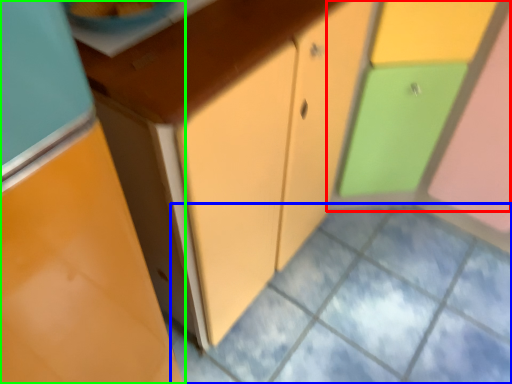
Question: Based on their relative distances, which object is nearer to cabinetry (highlighted by a red box)? Choose from square (highlighted by a blue box) and cabinetry (highlighted by a green box).

Choices:
 (A) square
 (B) cabinetry

Answer: (A)